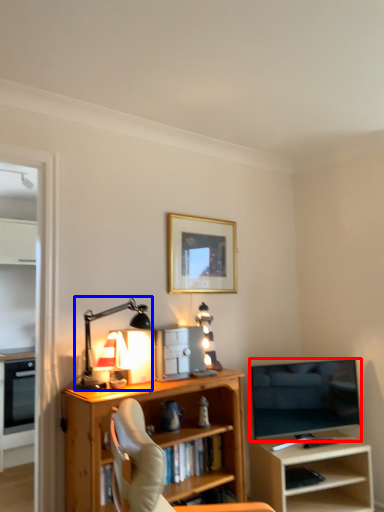
Question: Which object is further to the camera taking this photo, television (highlighted by a red box) or table lamp (highlighted by a blue box)?

Choices:
 (A) television
 (B) table lamp

Answer: (A)